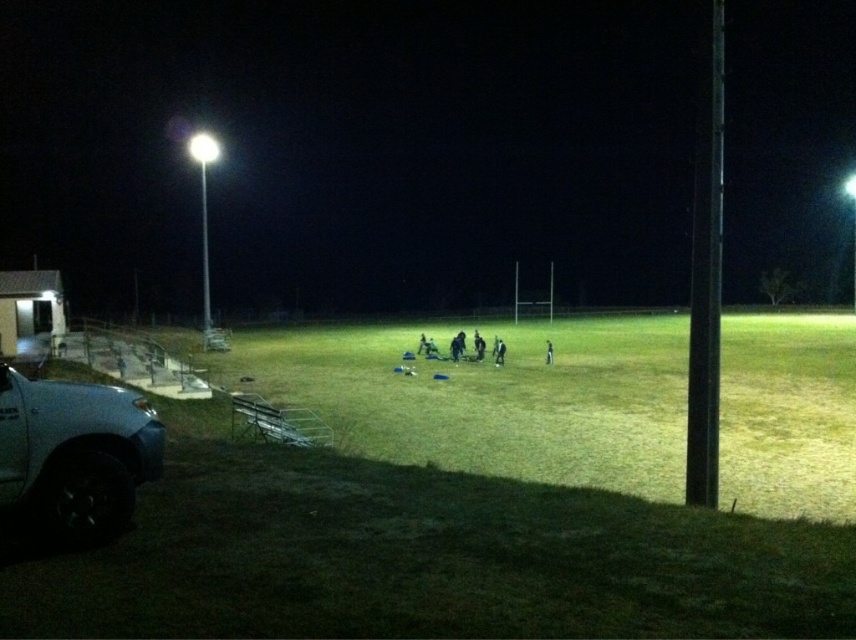
You are standing at the point labeled as point (x=492, y=397) in the image. What is the name of the location you are currently standing on?

You are standing on the green grass football field at center.

You are standing at the center of the sports field and want to walk towards the point labeled as point (9, 147). However, there is an obstacle at point (450, 369) blocking your path. Can you still reach your destination without going around the obstacle?

Yes, you can still reach point (9, 147) because it is located behind point (450, 369), meaning it is further away from your current position. You can walk past the obstacle at point (450, 369) to reach your destination.

You are standing at the center of the field where the group of people are. You need to locate the silver metallic truck at lower left. Which direction should you face to see it?

You should face towards the lower left direction to see the silver metallic truck at lower left, as it is located at point (x=74, y=456).